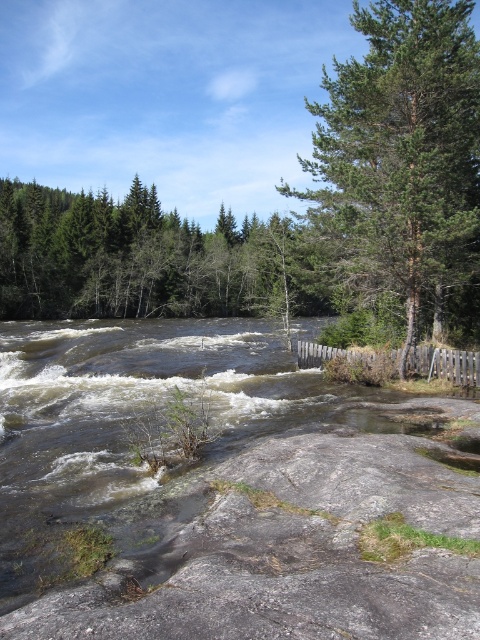
Does gray rough rock at center come in front of green textured tree at upper right?

Yes, gray rough rock at center is in front of green textured tree at upper right.

Consider the image. Does gray rough rock at center have a lesser height compared to green textured tree at upper right?

Yes, gray rough rock at center is shorter than green textured tree at upper right.

Where is `gray rough rock at center`? gray rough rock at center is located at coordinates (299, 554).

Does point (404, 96) lie behind point (113, 308)?

No.

Consider the image. Between green textured tree at upper right and green matte tree at upper left, which one appears on the right side from the viewer's perspective?

green textured tree at upper right

I want to click on green textured tree at upper right, so click(x=402, y=150).

Is gray rough rock at center positioned behind green matte tree at upper left?

No, gray rough rock at center is in front of green matte tree at upper left.

Between point (38, 604) and point (227, 228), which one is positioned in front?

Positioned in front is point (38, 604).

Locate an element on the screen. gray rough rock at center is located at coordinates (299, 554).